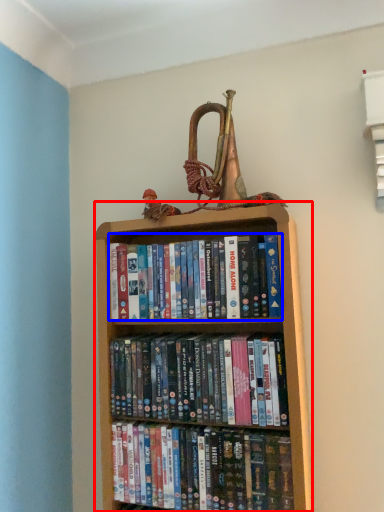
Question: Among these objects, which one is nearest to the camera, bookcase (highlighted by a red box) or book (highlighted by a blue box)?

Choices:
 (A) bookcase
 (B) book

Answer: (A)